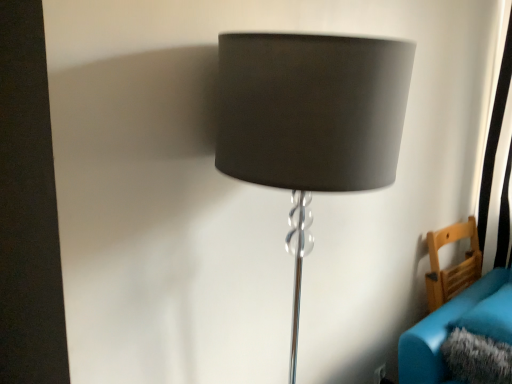
Question: In the image, is velvet teal couch at lower right on the left side or the right side of wooden chair at lower right?

Choices:
 (A) left
 (B) right

Answer: (A)

Question: Considering their positions, is velvet teal couch at lower right located in front of or behind wooden chair at lower right?

Choices:
 (A) front
 (B) behind

Answer: (A)

Question: Considering the real-world distances, which object is farthest from the velvet teal couch at lower right?

Choices:
 (A) matte gray lampshade at center
 (B) wooden chair at lower right

Answer: (A)

Question: Estimate the real-world distances between objects in this image. Which object is farther from the wooden chair at lower right?

Choices:
 (A) velvet teal couch at lower right
 (B) matte gray lampshade at center

Answer: (B)